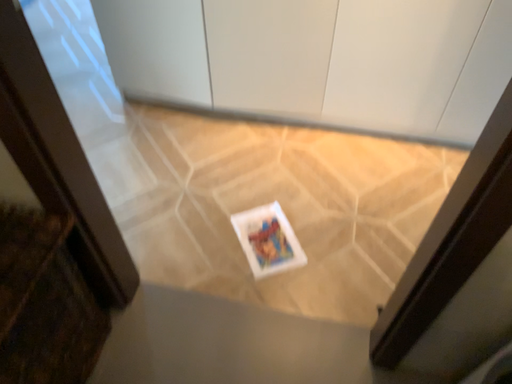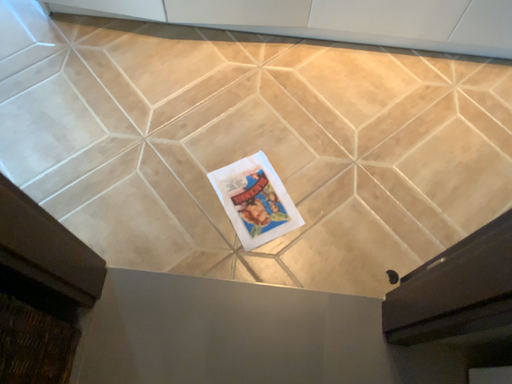
Question: Which way did the camera rotate in the video?

Choices:
 (A) rotated upward
 (B) rotated downward

Answer: (B)